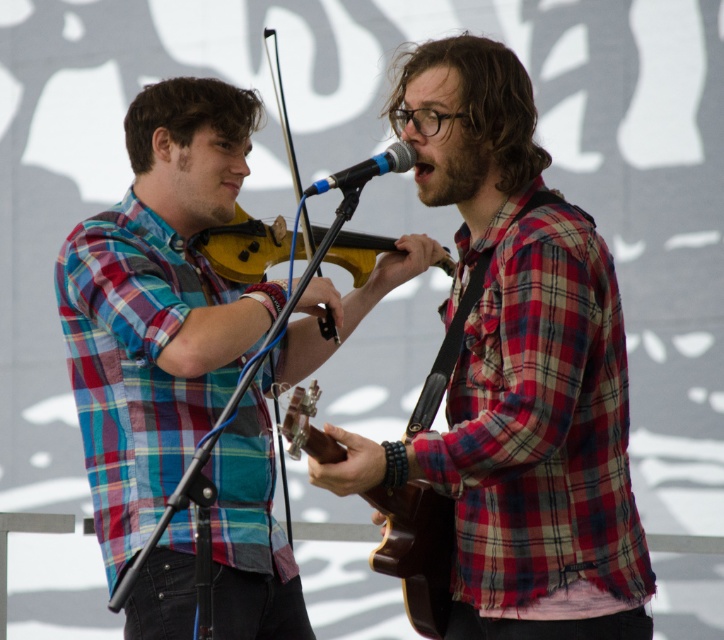
You are a stagehand setting up equipment for the performers. You need to place a protective cover over both the wooden violin at center and the blue metallic microphone at center. If the cover can only accommodate the larger object, which one should you ensure fits first?

The wooden violin at center has a larger size compared to the blue metallic microphone at center, so you should ensure the cover fits the wooden violin at center first.

You are a stagehand who needs to place a protective cover over both the wooden violin at center and the blue metallic microphone at center. Given that the cover can only accommodate the wider object, which object should you prioritize covering first?

The wooden violin at center should be prioritized since its width surpasses that of the blue metallic microphone at center, ensuring the cover fits properly over the wider object first.